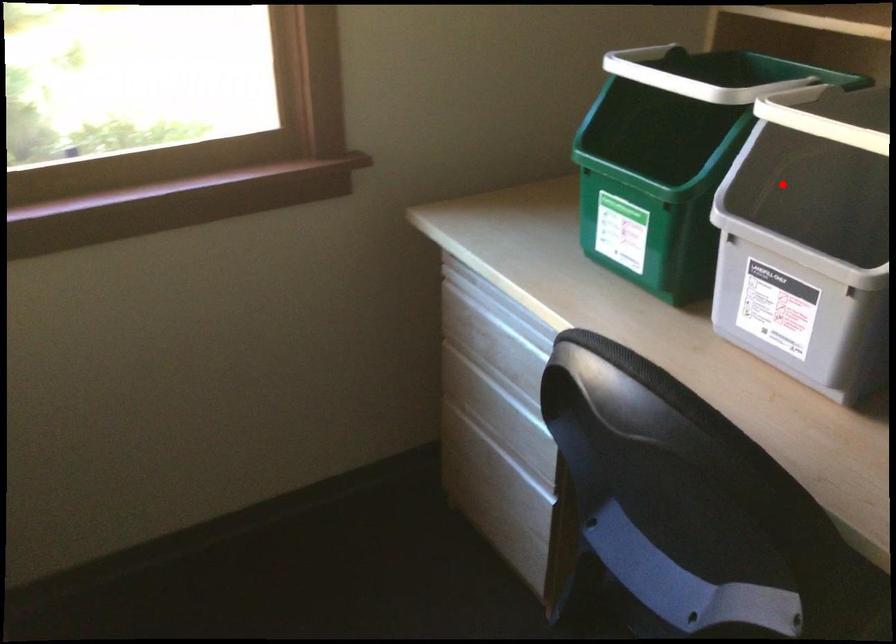
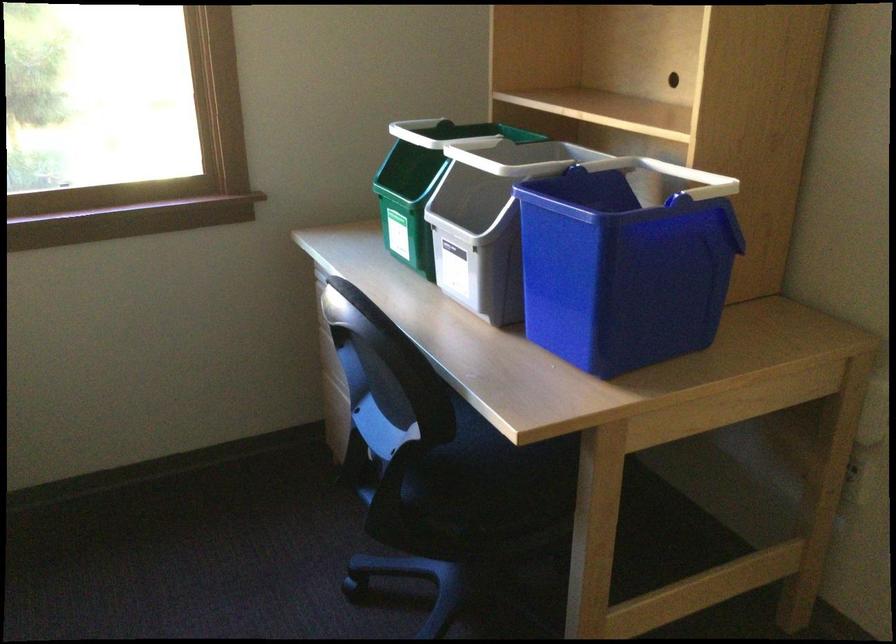
Where in the second image is the point corresponding to the highlighted location from the first image?

(479, 201)